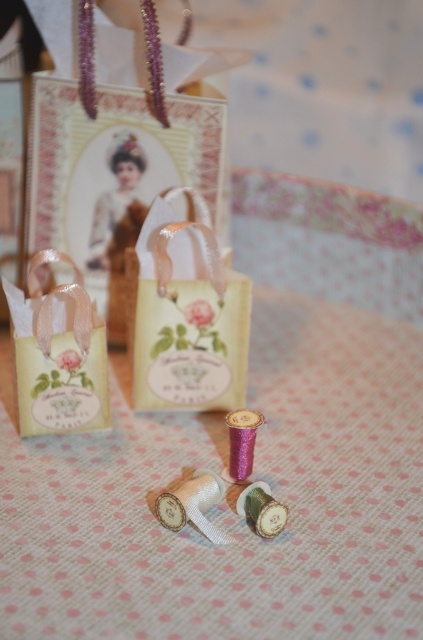
Question: Does matte paper bag at center have a smaller size compared to matte paper bag at left?

Choices:
 (A) no
 (B) yes

Answer: (A)

Question: Is matte paper bag at center thinner than matte paper bag at left?

Choices:
 (A) no
 (B) yes

Answer: (A)

Question: From the image, what is the correct spatial relationship of pink dotted fabric at center in relation to matte paper bag at center?

Choices:
 (A) above
 (B) below

Answer: (B)

Question: Among these objects, which one is farthest from the camera?

Choices:
 (A) matte paper bag at center
 (B) pink dotted fabric at center
 (C) matte paper bag at left

Answer: (A)

Question: Which of the following is the farthest from the observer?

Choices:
 (A) matte paper bag at center
 (B) matte paper bag at left

Answer: (A)

Question: Which point appears farthest from the camera in this image?

Choices:
 (A) (32, 365)
 (B) (249, 380)
 (C) (192, 385)

Answer: (B)